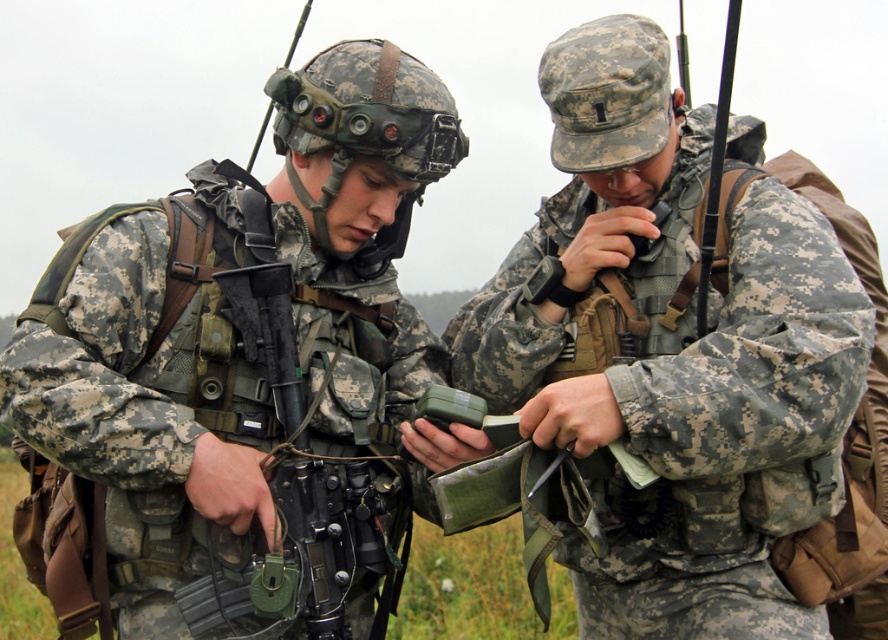
What are the coordinates of the camouflage uniform at center?

The coordinates of the camouflage uniform at center are at point (243, 369).

You are a military analyst assessing the equipment of two soldiers in the image. Which object, the camouflage fabric radio at center or the black matte rifle at center, would you recommend for a soldier needing to carry a larger device for communication purposes?

The camouflage fabric radio at center is bigger than the black matte rifle at center, so it would be the better choice for carrying a larger device for communication purposes.